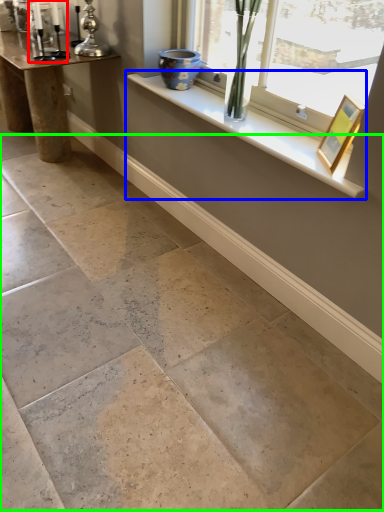
Question: Which object is positioned closest to candle holder (highlighted by a red box)? Select from window sill (highlighted by a blue box) and concrete (highlighted by a green box).

Choices:
 (A) window sill
 (B) concrete

Answer: (A)